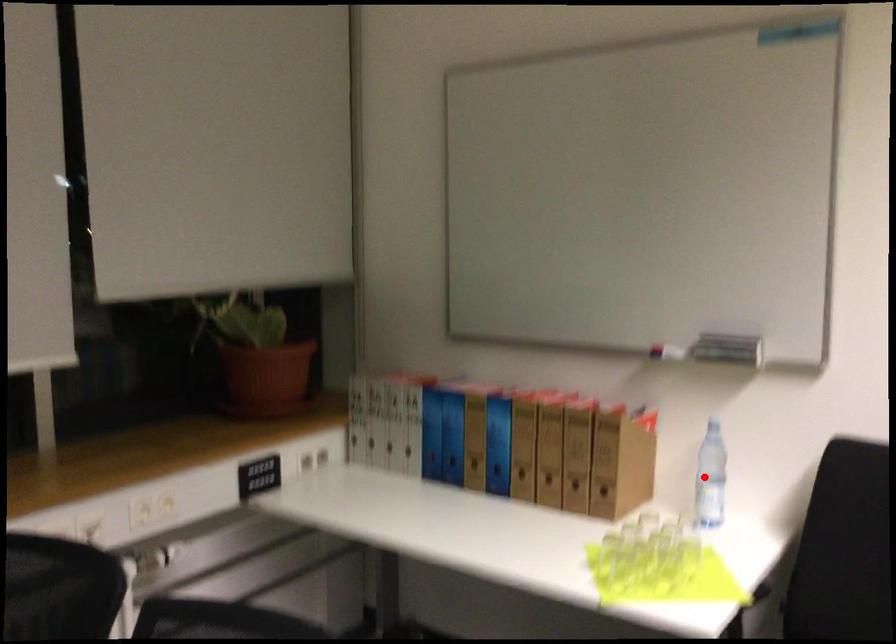
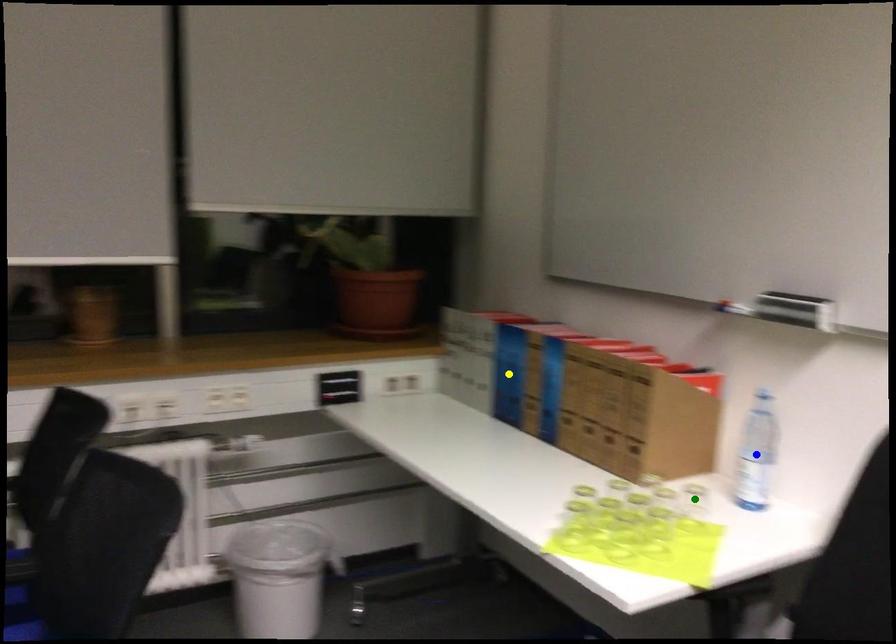
Question: I am providing you with two images of the same scene from different viewpoints. A red point is marked on the first image. You are given multiple points on the second image. Can you choose the point in image 2 that corresponds to the point in image 1?

Choices:
 (A) blue point
 (B) green point
 (C) yellow point

Answer: (A)